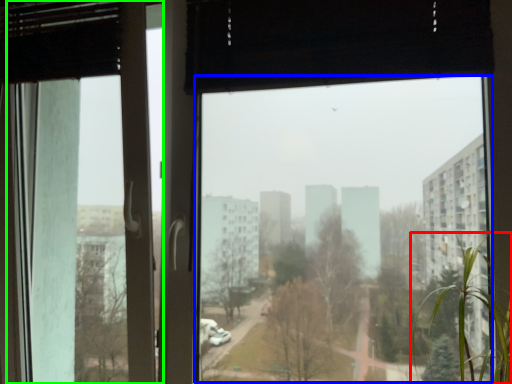
Question: Estimate the real-world distances between objects in this image. Which object is closer to tree (highlighted by a red box), window screen (highlighted by a blue box) or screen door (highlighted by a green box)?

Choices:
 (A) window screen
 (B) screen door

Answer: (B)